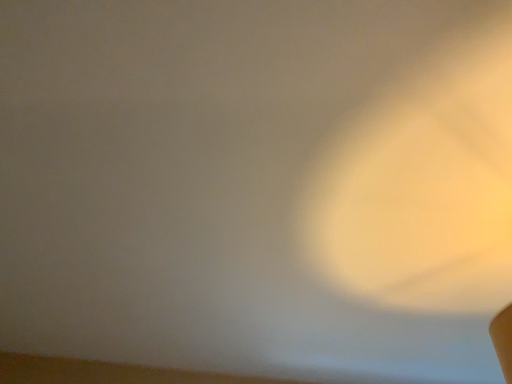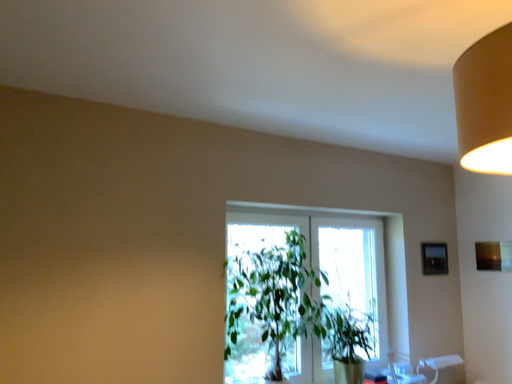
Question: Which way did the camera rotate in the video?

Choices:
 (A) rotated right
 (B) rotated left

Answer: (A)